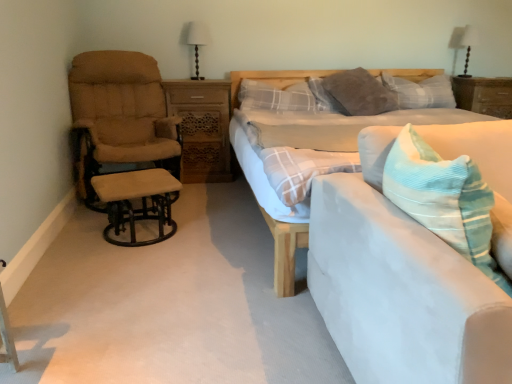
Locate an element on the screen. vacant area that is in front of beige fabric recliner at left is located at coordinates (100, 240).